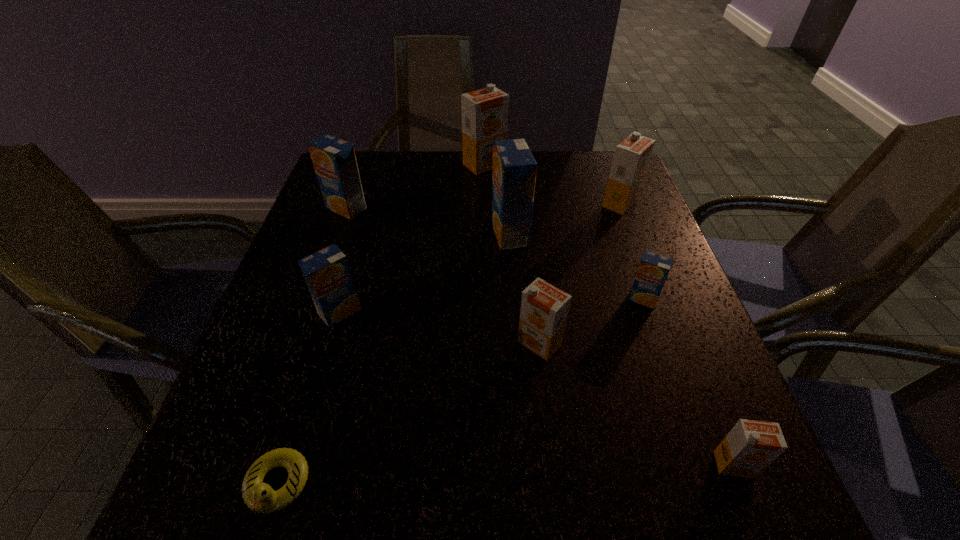
The width and height of the screenshot is (960, 540). Identify the location of orange juice at the near edge. (751, 446).

Find the location of a particular element. duckling located at the near edge is located at coordinates (260, 497).

You are a GUI agent. You are given a task and a screenshot of the screen. Output one action in this format:
    pyautogui.click(x=<x>, y=<y>)
    Task: Click on the duckling located in the left edge section of the desktop
    
    Given the screenshot: What is the action you would take?
    pyautogui.click(x=260, y=497)

This screenshot has width=960, height=540. In order to click on object at the far left corner in this screenshot , I will do `click(334, 160)`.

Locate an element on the screen. This screenshot has width=960, height=540. object that is at the near left corner is located at coordinates (260, 497).

Locate an element on the screen. This screenshot has width=960, height=540. object located in the far right corner section of the desktop is located at coordinates (631, 158).

Image resolution: width=960 pixels, height=540 pixels. I want to click on object positioned at the near right corner, so click(x=751, y=446).

Where is `vacant space at the far edge of the desktop`? vacant space at the far edge of the desktop is located at coordinates (464, 183).

In the image, there is a desktop. Where is `free region at the near edge`? This screenshot has width=960, height=540. free region at the near edge is located at coordinates (641, 512).

This screenshot has height=540, width=960. I want to click on free spot at the left edge of the desktop, so point(331,230).